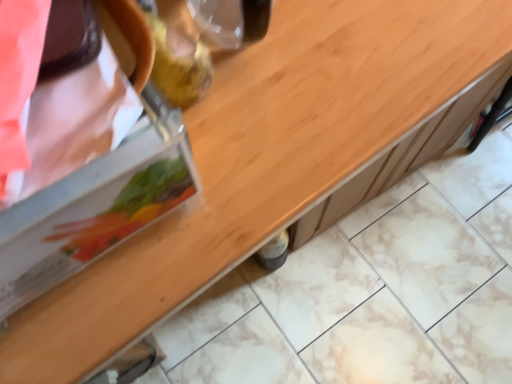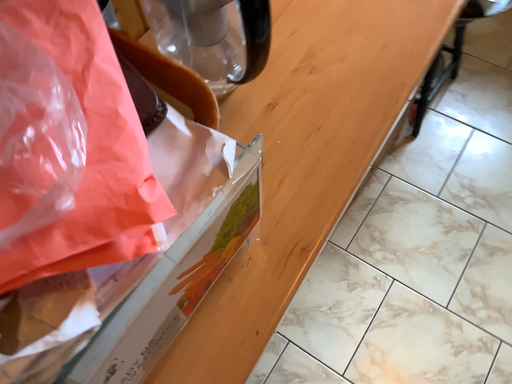
Question: How did the camera likely rotate when shooting the video?

Choices:
 (A) rotated upward
 (B) rotated downward

Answer: (A)